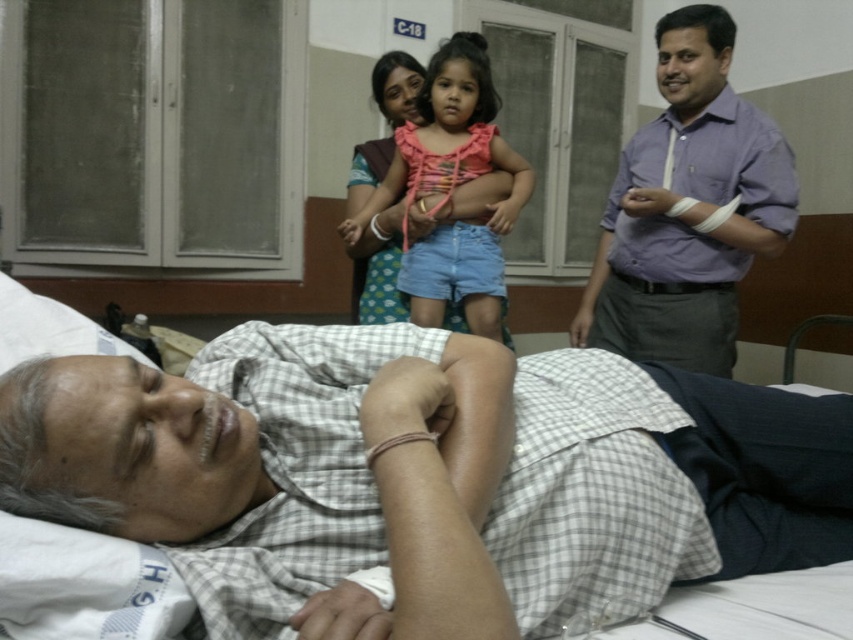
You are a nurse standing 1.5 meters away from the camera. You need to hand a medical chart to the person wearing the purple cotton shirt at right. Can you reach them without moving closer?

The purple cotton shirt at right is 1.93 meters away from the camera. Since you are 1.5 meters away from the camera, you are 0.43 meters closer than the shirt. Therefore, you can reach them without moving closer.

You are a hospital staff member who needs to determine which clothing item takes up more area in the image. Which one is larger between the checkered fabric shirt at center and the purple cotton shirt at right?

The purple cotton shirt at right takes up more area in the image because the checkered fabric shirt at center occupies less space than it.

You are a nurse in the hospital room and need to determine which of the two shirts, the checkered fabric shirt at center or the purple cotton shirt at right, is shorter in height. Based on the scene, which one is shorter?

The checkered fabric shirt at center is shorter in height than the purple cotton shirt at right because it is described as not as tall as the purple cotton shirt at right.